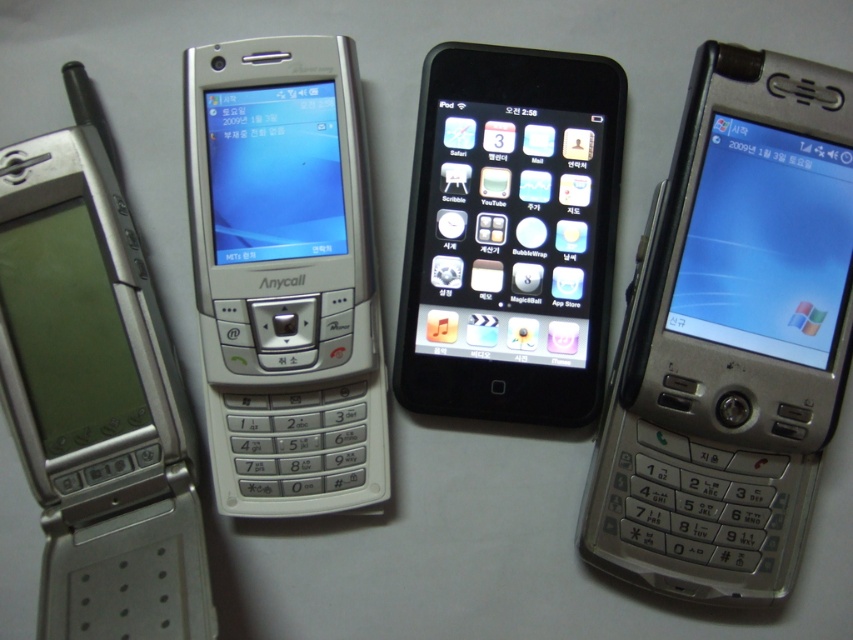
Which phone is marked by the point at coordinates (730, 337)?

The point at coordinates (730, 337) marks the silver metallic phone at right.

You are trying to place both the silver metallic phone at right and the black glossy ipod at center into a rectangular case that can only fit items up to 10 cm in width. Based on their widths, will both items fit side by side?

The silver metallic phone at right might be wider than the black glossy ipod at center. Since the case can only accommodate up to 10 cm, there is a possibility that together their combined width exceeds the limit. However, without exact measurements, it is uncertain if they will fit.

You are a delivery person who needs to place a package between the silver metallic phone at center and the black glossy ipod at center. Can you fit the package in between them?

Result: The silver metallic phone at center is to the left of the black glossy ipod at center, so there is space between them to place the package.